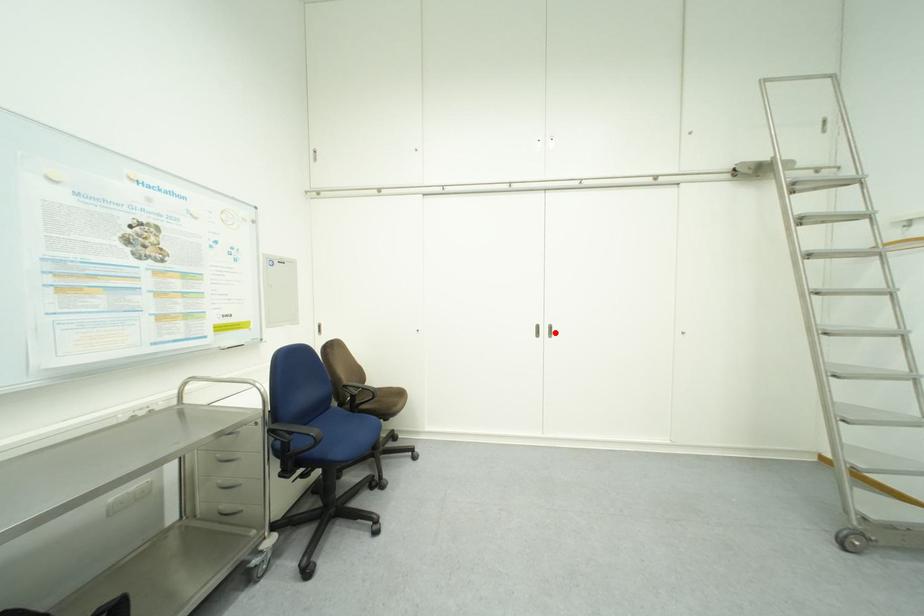
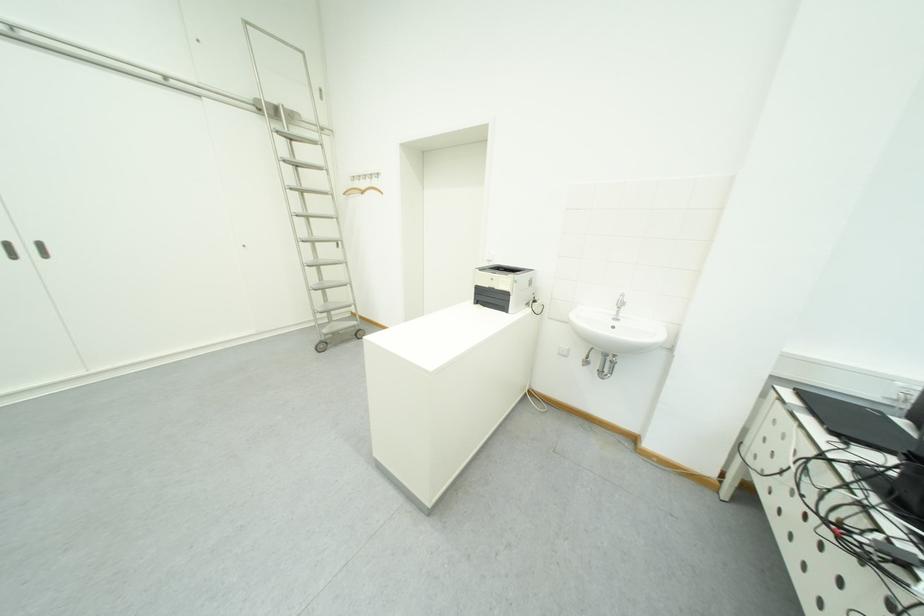
Find the pixel in the second image that matches the highlighted location in the first image.

(40, 252)